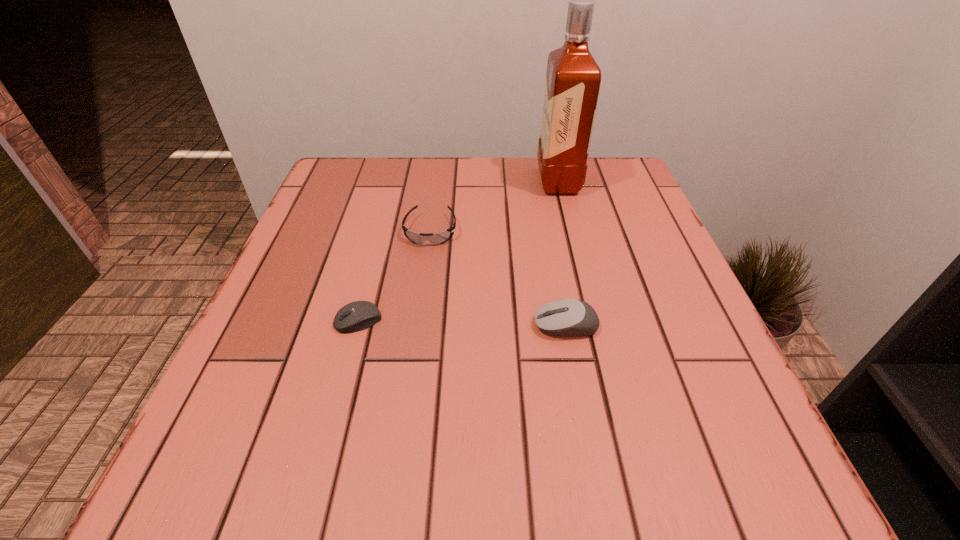
Locate an element on the screen. This screenshot has height=540, width=960. vacant space located 0.110m on the front label of the tallest object is located at coordinates (494, 181).

Identify the location of blank space located 0.330m on the wheel side of the second tallest object. The width and height of the screenshot is (960, 540). (340, 325).

I want to click on free point located 0.370m on the wheel side of the second tallest object, so click(317, 325).

Locate an element on the screen. Image resolution: width=960 pixels, height=540 pixels. blank area located on the wheel side of the second tallest object is located at coordinates (405, 325).

You are a GUI agent. You are given a task and a screenshot of the screen. Output one action in this format:
    pyautogui.click(x=<x>, y=<y>)
    Task: Click on the free region located 0.110m on the lenses of the second farthest object
    Image resolution: width=960 pixels, height=540 pixels.
    Given the screenshot: What is the action you would take?
    pyautogui.click(x=423, y=286)

I want to click on vacant area situated 0.380m on the back of the leftmost object, so click(x=393, y=192).

Identify the location of object that is positioned at the far edge. (573, 78).

The image size is (960, 540). I want to click on object situated at the left edge, so click(359, 315).

Locate an element on the screen. The image size is (960, 540). object at the right edge is located at coordinates (573, 78).

This screenshot has width=960, height=540. Identify the location of object positioned at the far right corner. (573, 78).